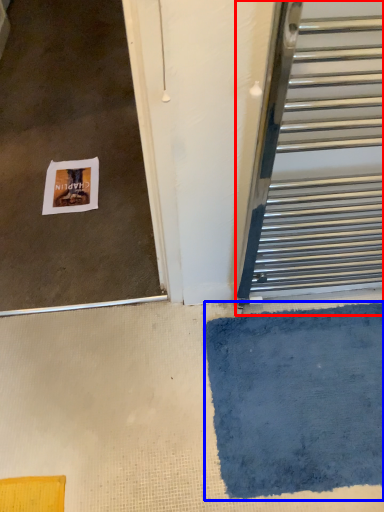
Question: Which object appears farthest to the camera in this image, door (highlighted by a red box) or bath mat (highlighted by a blue box)?

Choices:
 (A) door
 (B) bath mat

Answer: (B)